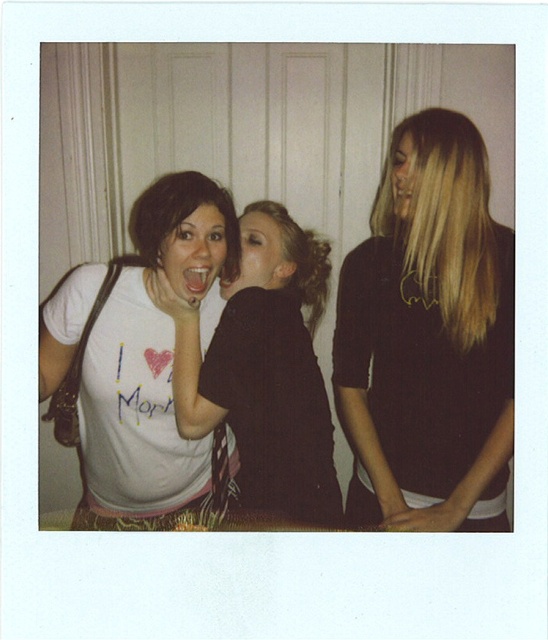
Is smooth black shirt at right shorter than matte black mouth at center?

In fact, smooth black shirt at right may be taller than matte black mouth at center.

Who is more distant from viewer, (483, 164) or (406, 195)?

The point (406, 195) is more distant.

You are a GUI agent. You are given a task and a screenshot of the screen. Output one action in this format:
    pyautogui.click(x=<x>, y=<y>)
    Task: Click on the smooth black shirt at right
    This screenshot has height=640, width=548.
    Given the screenshot: What is the action you would take?
    pyautogui.click(x=429, y=340)

Identify the location of smooth black shirt at right. The width and height of the screenshot is (548, 640). (429, 340).

Can you confirm if smooth black shirt at right is positioned below matte white t-shirt at center-left?

Correct, smooth black shirt at right is located below matte white t-shirt at center-left.

Is smooth black shirt at right shorter than matte white t-shirt at center-left?

In fact, smooth black shirt at right may be taller than matte white t-shirt at center-left.

Is point (437, 465) farther from viewer compared to point (191, 227)?

Yes, point (437, 465) is behind point (191, 227).

Where is `smooth black shirt at right`? The height and width of the screenshot is (640, 548). smooth black shirt at right is located at coordinates (429, 340).

Between dark brown sweater at center and pink matte lips at center, which one appears on the left side from the viewer's perspective?

pink matte lips at center is more to the left.

Which of these two, dark brown sweater at center or pink matte lips at center, stands shorter?

pink matte lips at center is shorter.

Looking at this image, who is more distant from viewer, [242,340] or [201,291]?

The point [201,291] is more distant.

You are a GUI agent. You are given a task and a screenshot of the screen. Output one action in this format:
    pyautogui.click(x=<x>, y=<y>)
    Task: Click on the dark brown sweater at center
    The width and height of the screenshot is (548, 640).
    Given the screenshot: What is the action you would take?
    pyautogui.click(x=265, y=369)